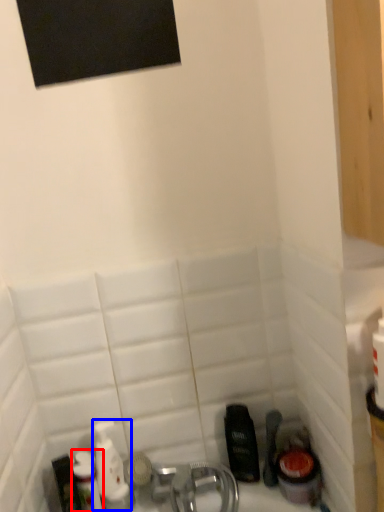
Question: Which object appears closest to the camera in this image, toiletry (highlighted by a red box) or mouthwash (highlighted by a blue box)?

Choices:
 (A) toiletry
 (B) mouthwash

Answer: (A)